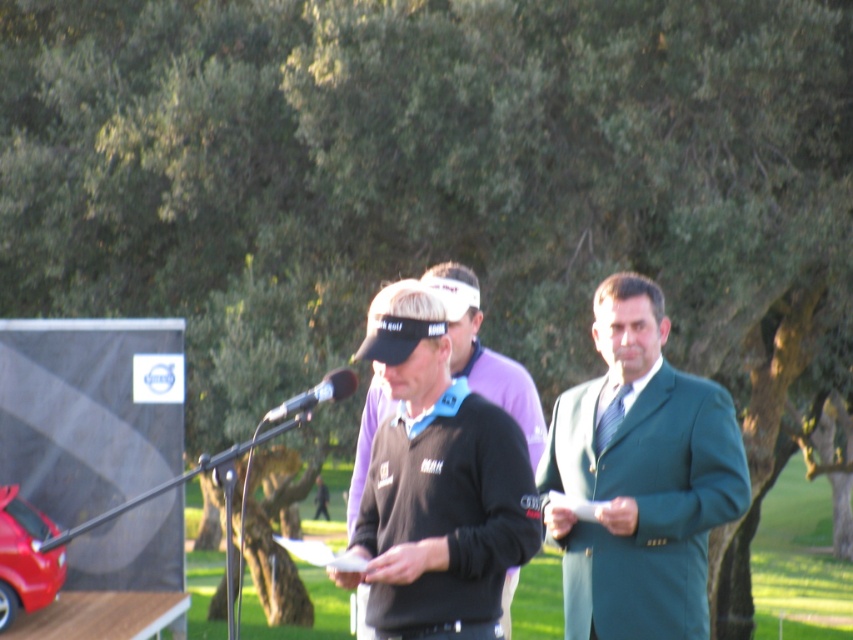
Question: Which object is closer to the camera taking this photo?

Choices:
 (A) black matte jacket at center
 (B) black metallic microphone at center
 (C) green wool suit at center

Answer: (A)

Question: Is green wool suit at center bigger than black matte jacket at center?

Choices:
 (A) no
 (B) yes

Answer: (B)

Question: In this image, where is black matte jacket at center located relative to black metallic microphone at center?

Choices:
 (A) below
 (B) above

Answer: (A)

Question: Is green wool suit at center wider than black metallic microphone at center?

Choices:
 (A) yes
 (B) no

Answer: (B)

Question: Considering the real-world distances, which object is closest to the black matte jacket at center?

Choices:
 (A) black metallic microphone at center
 (B) green wool suit at center

Answer: (A)

Question: Which object is closer to the camera taking this photo?

Choices:
 (A) black matte jacket at center
 (B) black metallic microphone at center
 (C) green wool suit at center

Answer: (A)